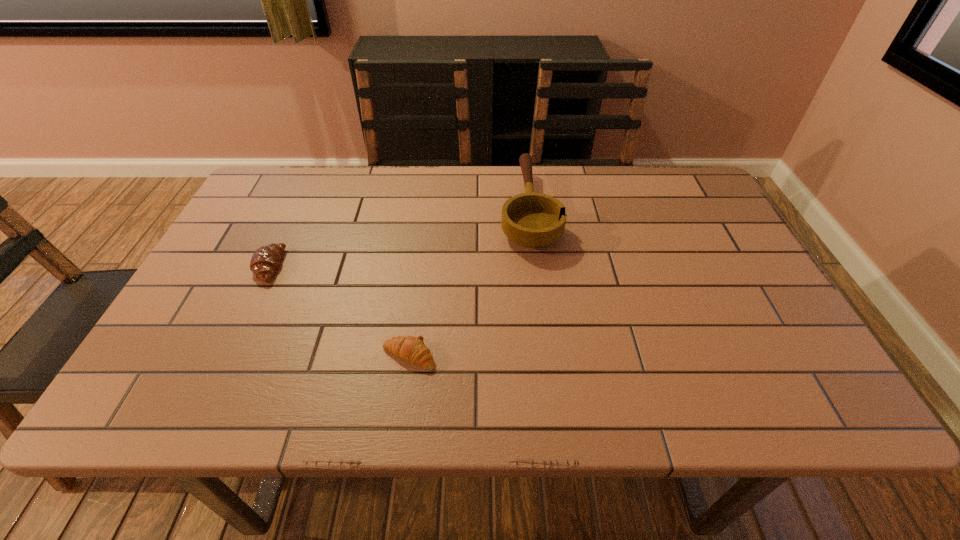
The width and height of the screenshot is (960, 540). In order to click on vacant space at the far edge of the desktop in this screenshot , I will do `click(621, 181)`.

Find the location of a particular element. This screenshot has height=540, width=960. vacant space at the left edge is located at coordinates (162, 354).

This screenshot has width=960, height=540. I want to click on free space at the right edge, so click(696, 265).

This screenshot has width=960, height=540. What are the coordinates of `free point at the far left corner` in the screenshot? It's located at (280, 211).

At what (x,y) coordinates should I click in order to perform the action: click on free region at the near left corner of the desktop. Please return your answer as a coordinate pair (x, y). Looking at the image, I should click on (165, 408).

In the image, there is a desktop. Where is `vacant space at the near right corner`? The width and height of the screenshot is (960, 540). vacant space at the near right corner is located at coordinates (754, 388).

Identify the location of vacant region between the tallest object and the left crescent roll. The height and width of the screenshot is (540, 960). (398, 238).

Where is `vacant space that's between the saucepan and the nearest object`? This screenshot has height=540, width=960. vacant space that's between the saucepan and the nearest object is located at coordinates (468, 282).

The image size is (960, 540). What are the coordinates of `vacant area between the farther crescent roll and the shortest object` in the screenshot? It's located at (339, 311).

Find the location of `vacant region between the leftmost object and the saucepan`. vacant region between the leftmost object and the saucepan is located at coordinates (398, 238).